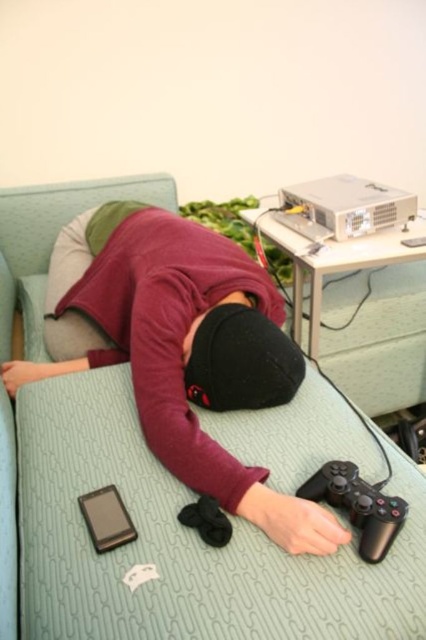
Is green fabric bed at center shorter than black matte game controller at lower right?

No.

Does green fabric bed at center appear on the left side of black matte game controller at lower right?

Yes, green fabric bed at center is to the left of black matte game controller at lower right.

You are a GUI agent. You are given a task and a screenshot of the screen. Output one action in this format:
    pyautogui.click(x=<x>, y=<y>)
    Task: Click on the green fabric bed at center
    The image size is (426, 640).
    Given the screenshot: What is the action you would take?
    pyautogui.click(x=170, y=540)

Image resolution: width=426 pixels, height=640 pixels. What are the coordinates of `green fabric bed at center` in the screenshot? It's located at (170, 540).

Who is positioned more to the left, black matte game controller at lower right or black matte smartphone at lower left?

From the viewer's perspective, black matte smartphone at lower left appears more on the left side.

Who is more forward, (363,548) or (100,541)?

Point (363,548)

Between point (374, 522) and point (118, 522), which one is positioned in front?

Point (374, 522) is more forward.

Find the location of a particular element. black matte game controller at lower right is located at coordinates (357, 506).

Is green fabric bed at center positioned in front of black matte smartphone at lower left?

Yes, green fabric bed at center is in front of black matte smartphone at lower left.

Consider the image. Who is higher up, green fabric bed at center or black matte smartphone at lower left?

green fabric bed at center

Who is more forward, (x=175, y=508) or (x=94, y=538)?

Positioned in front is point (x=94, y=538).

Where is `green fabric bed at center`? green fabric bed at center is located at coordinates (170, 540).